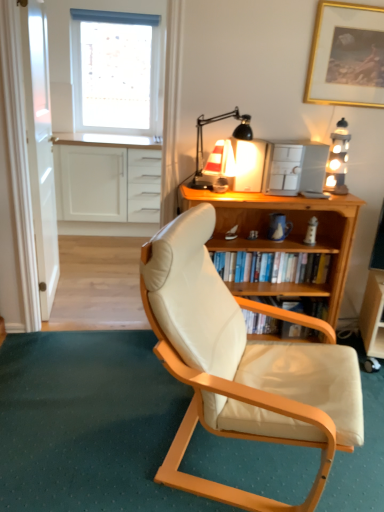
Image resolution: width=384 pixels, height=512 pixels. What are the coordinates of `unoccupied space behind transparent glass door at left` in the screenshot? It's located at (91, 270).